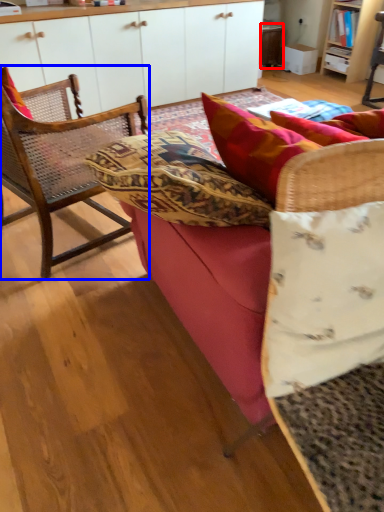
Question: Among these objects, which one is nearest to the camera, table (highlighted by a red box) or chair (highlighted by a blue box)?

Choices:
 (A) table
 (B) chair

Answer: (B)